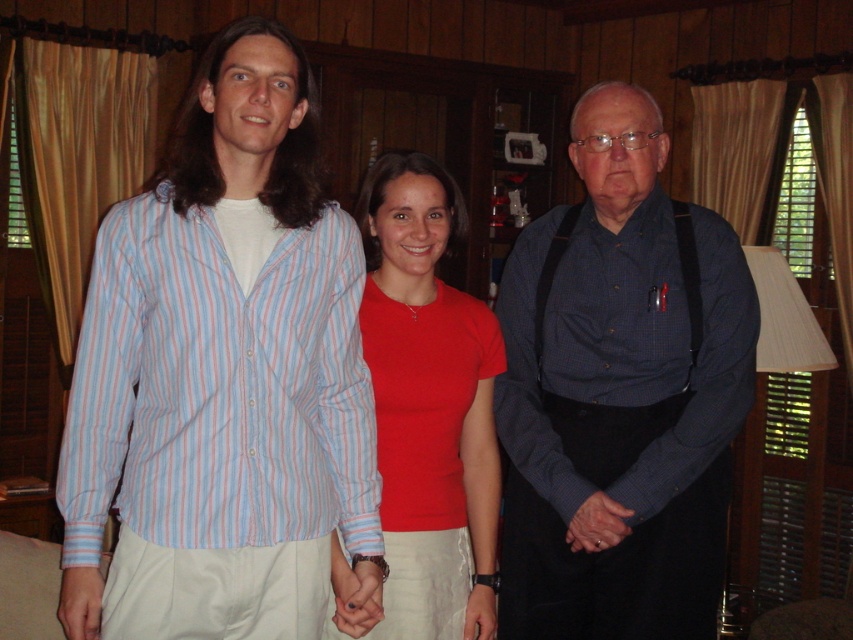
You are standing in the rustic room and want to greet both people wearing the light blue striped shirt at left and the blue checkered shirt at center. Which person should you approach first if you want to greet the one closer to the entrance?

The light blue striped shirt at left is closer to the entrance because it is positioned to the left of the blue checkered shirt at center, which is further away from the entrance.

You are a photographer setting up a camera at eye level. You want to capture both the light blue striped shirt at left and the matte red shirt at center in the same frame. Which shirt should you adjust to ensure both are fully visible in the photo?

The light blue striped shirt at left is above the matte red shirt at center, so you should lower the camera angle slightly to ensure both shirts are fully visible in the photo.